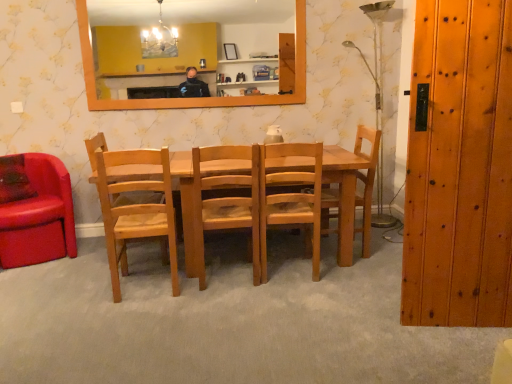
The width and height of the screenshot is (512, 384). In order to click on vacant area to the left of natural wood chair at left, the 2th chair from the left in this screenshot , I will do `click(75, 294)`.